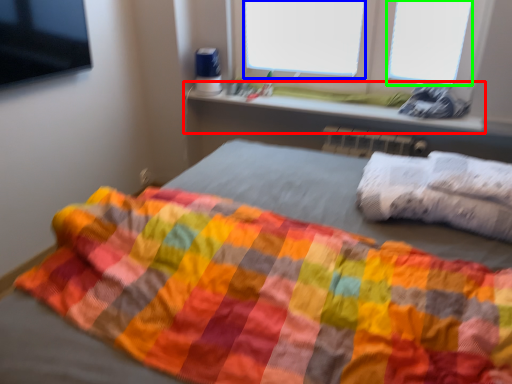
Question: Based on their relative distances, which object is nearer to window sill (highlighted by a red box)? Choose from window screen (highlighted by a blue box) and window screen (highlighted by a green box).

Choices:
 (A) window screen
 (B) window screen

Answer: (A)